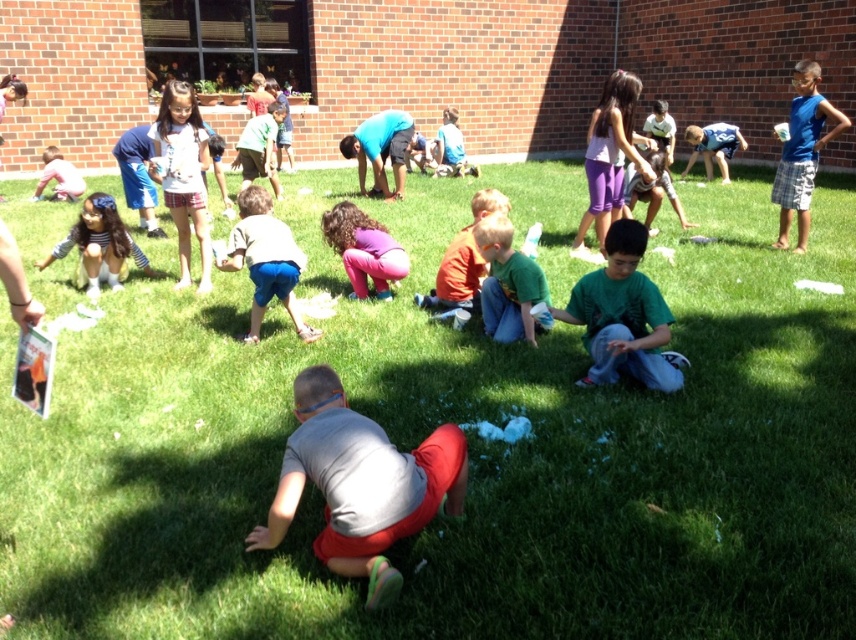
You are a photographer trying to capture a group photo of the children. You notice the blue shirt at upper right and the light pink shirt at lower left. Which child should you ask to move closer to ensure their shirts appear the same size in the photo?

The blue shirt at upper right is wider than the light pink shirt at lower left. To make their shirts appear the same size in the photo, the photographer should ask the blue shirt at upper right to move closer to the camera since it is larger and needs to be reduced in size in the frame.

Looking at this image, you are a parent trying to locate your child who is wearing a light pink shirt at lower left and another child squatting with gray fabric squat at center. Which child is smaller in size?

The gray fabric squat at center is smaller in size compared to the light pink shirt at lower left.

You are a photographer trying to capture a group photo of the children in the scene. You need to ensure that the gray fabric squat at center and the light pink shirt at lower left are both in the frame. Considering their sizes, which object should you focus on to ensure both are visible without cropping?

Since the gray fabric squat at center is wider than the light pink shirt at lower left, you should focus on the gray fabric squat at center as it requires more space in the frame to accommodate its larger width.